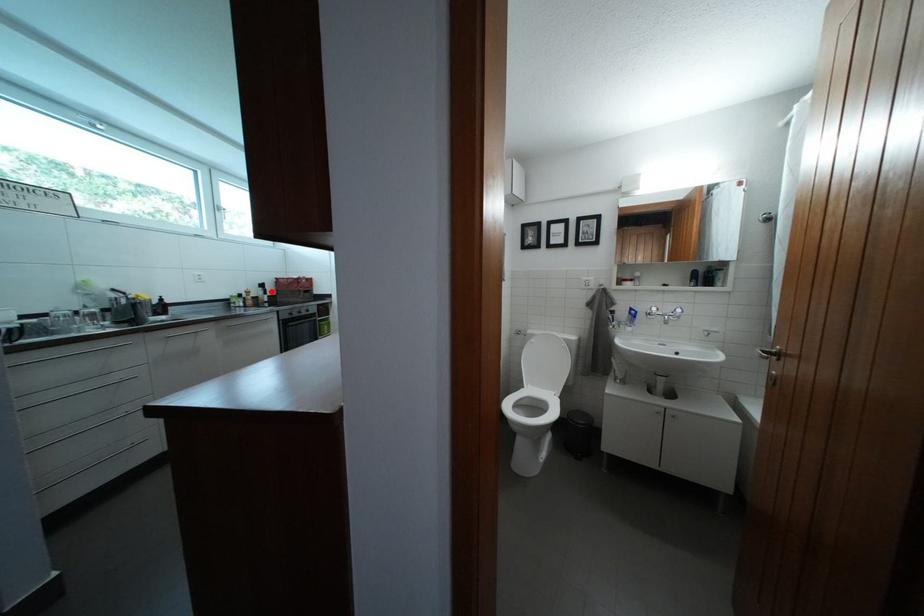
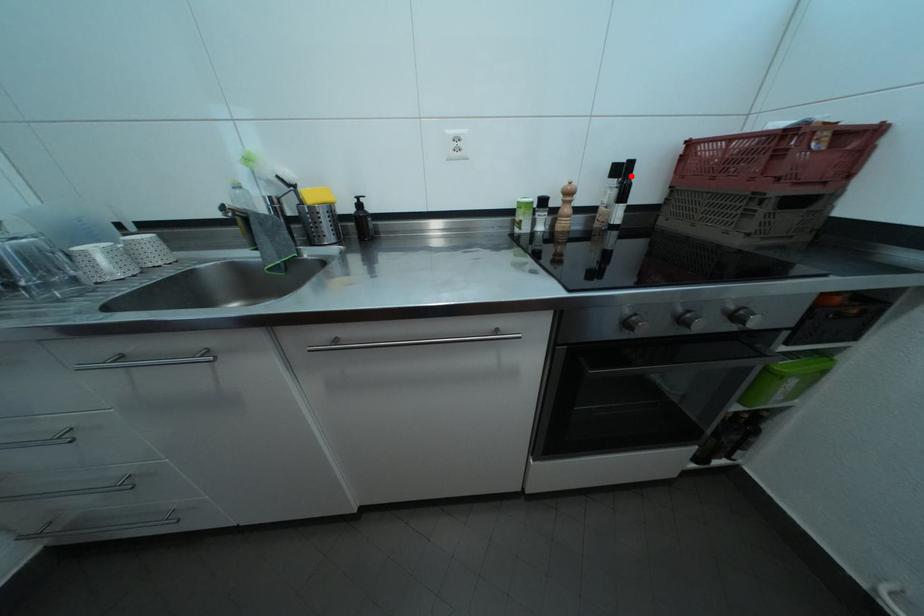
Looking at this image, I am providing you with two images of the same scene from different viewpoints. A red point is marked on the first image and another point is marked on the second image. Is the red point in image1 aligned with the point shown in image2?

Yes